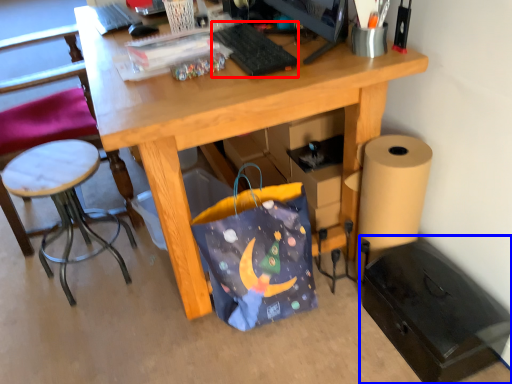
Question: Which point is closer to the camera, keyboard (highlighted by a red box) or file cabinet (highlighted by a blue box)?

Choices:
 (A) keyboard
 (B) file cabinet

Answer: (B)